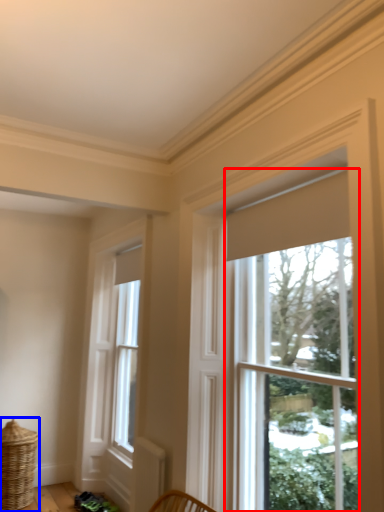
Question: Which of the following is the closest to the observer, window (highlighted by a red box) or basket (highlighted by a blue box)?

Choices:
 (A) window
 (B) basket

Answer: (A)